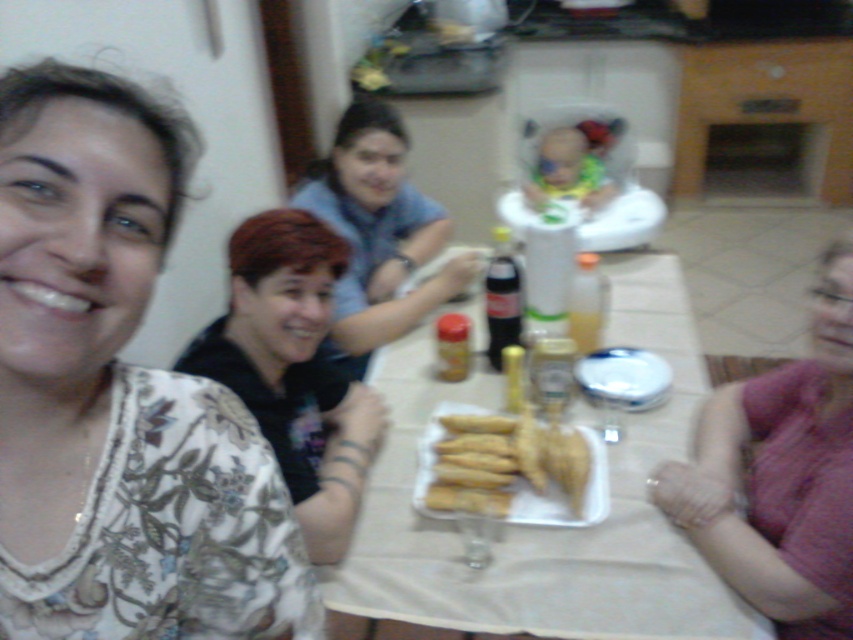
Where is the matte blue shirt at center located in the image?

The matte blue shirt at center is located at point coordinates of 0.366 on the x axis and 0.444 on the y axis.

You are a guest at the gathering and want to reach for the white paper tray at center without disturbing the floral print blouse at left. Is the tray within your reach?

The floral print blouse at left is not as tall as the white paper tray at center, so the tray is taller than the blouse. Since the tray is taller, it might be easier to reach over the blouse to grab the tray.